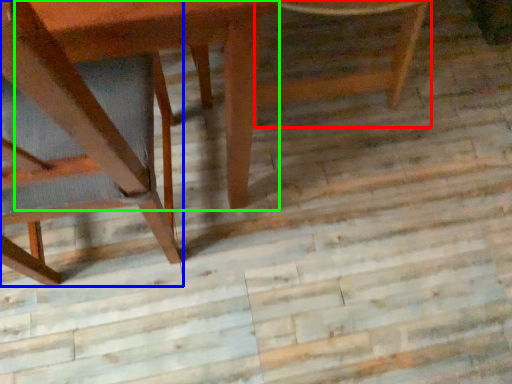
Question: Estimate the real-world distances between objects in this image. Which object is closer to chair (highlighted by a red box), chair (highlighted by a blue box) or round table (highlighted by a green box)?

Choices:
 (A) chair
 (B) round table

Answer: (B)